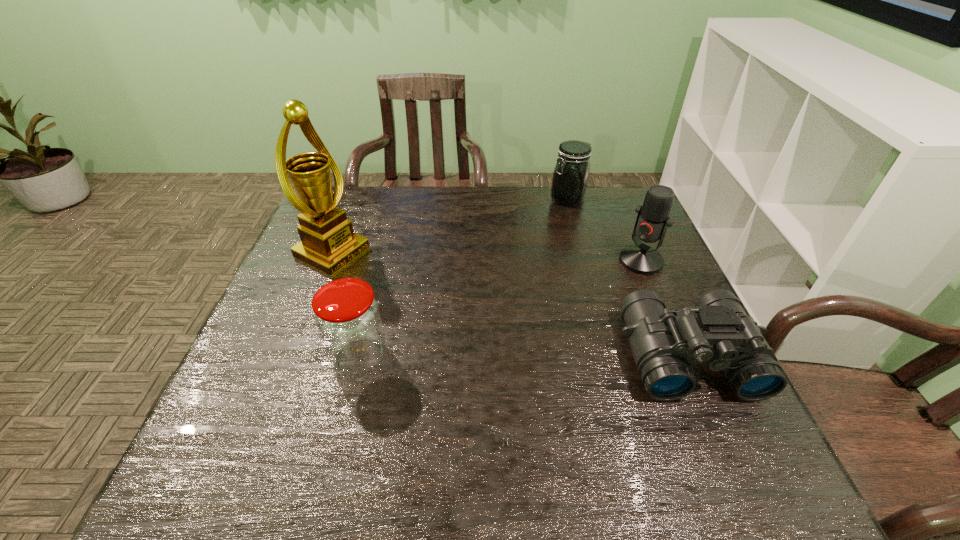
Where is `the left jar`? Image resolution: width=960 pixels, height=540 pixels. the left jar is located at coordinates (347, 316).

Find the location of a particular element. The image size is (960, 540). binoculars is located at coordinates (717, 330).

Where is `the right jar`? the right jar is located at coordinates (570, 177).

Identify the location of the farther jar. (570, 177).

The image size is (960, 540). What are the coordinates of `the tallest object` in the screenshot? It's located at (328, 243).

At what (x,y) coordinates should I click in order to perform the action: click on the fourth shortest object. Please return your answer as a coordinate pair (x, y). This screenshot has width=960, height=540. Looking at the image, I should click on (653, 219).

Find the location of a particular element. vacant space situated on the left of the left jar is located at coordinates (308, 356).

Identify the location of free region located on the lid of the farther jar. Image resolution: width=960 pixels, height=540 pixels. (527, 276).

At what (x,y) coordinates should I click in order to perform the action: click on free spot located 0.130m on the lid of the farther jar. Please return your answer as a coordinate pair (x, y). The image size is (960, 540). Looking at the image, I should click on (551, 231).

The height and width of the screenshot is (540, 960). I want to click on vacant space located on the lid of the farther jar, so click(x=553, y=227).